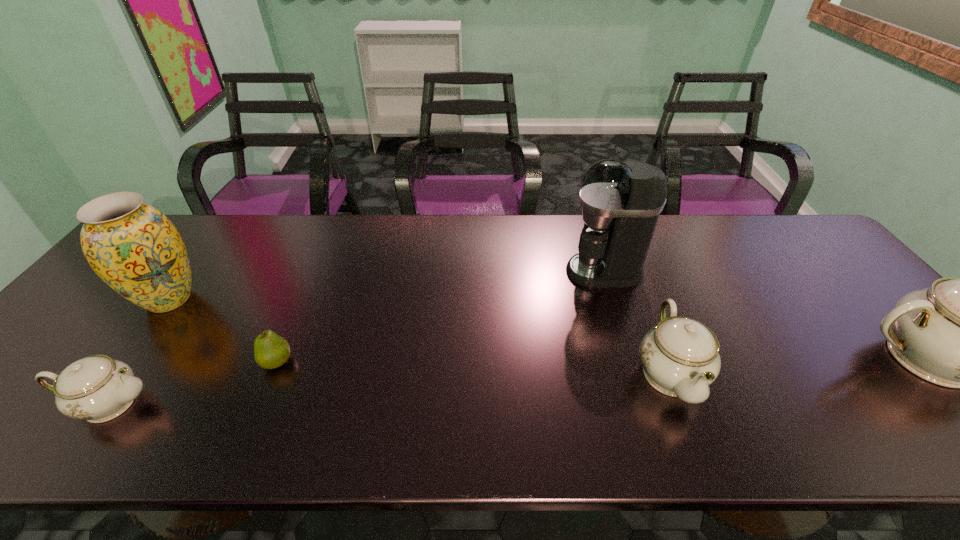
Identify the location of vacant position for inserting another chinaware evenly. The height and width of the screenshot is (540, 960). (397, 387).